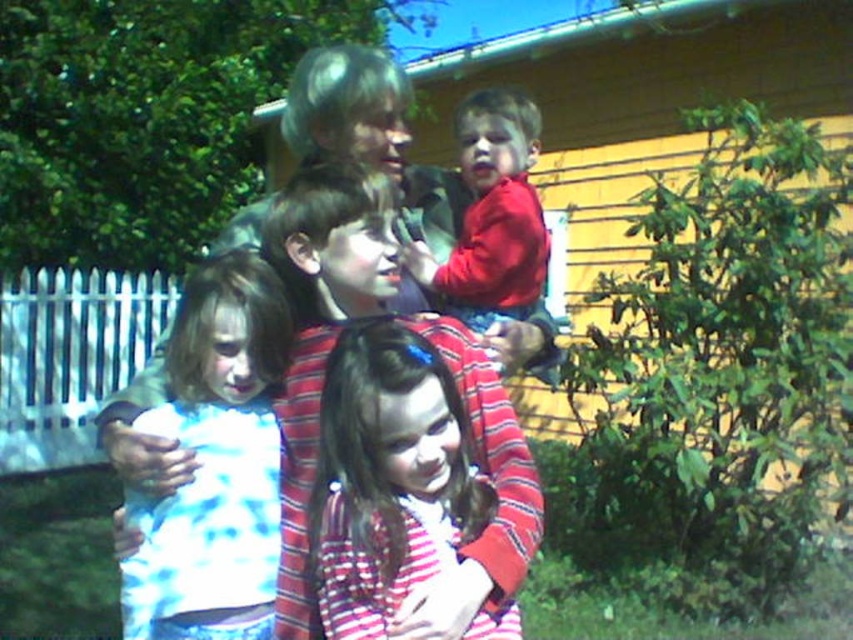
You are standing in the backyard and want to place two garden statues. You have two points marked in the image where you can place them. The first point is at coordinates point (412, 412) and the second is at point (508, 291). Which point is closer to you?

Point (412, 412) is closer to the viewer than point (508, 291).

Based on the photo, what object is located at the coordinates point (387,476) in the image?

The point (387,476) corresponds to the striped fabric shirt at center.